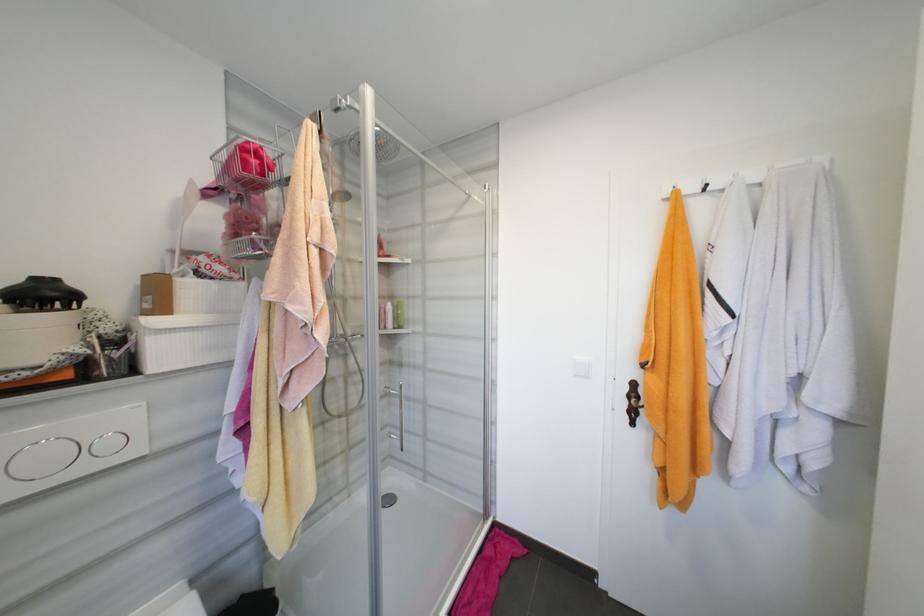
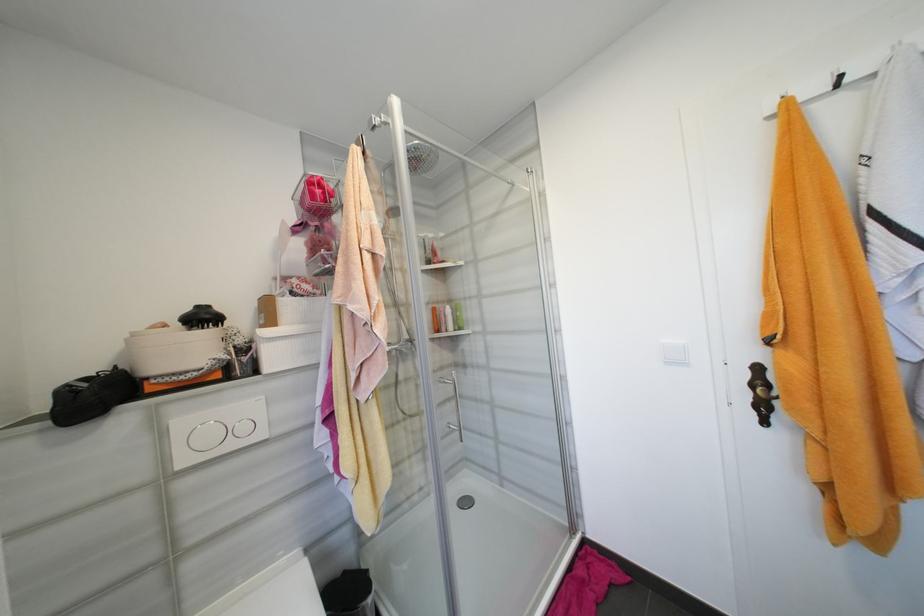
Question: The camera is either moving clockwise (left) or counter-clockwise (right) around the object. The first image is from the beginning of the video and the second image is from the end. Is the camera moving left or right when shooting the video?

Choices:
 (A) Left
 (B) Right

Answer: (B)